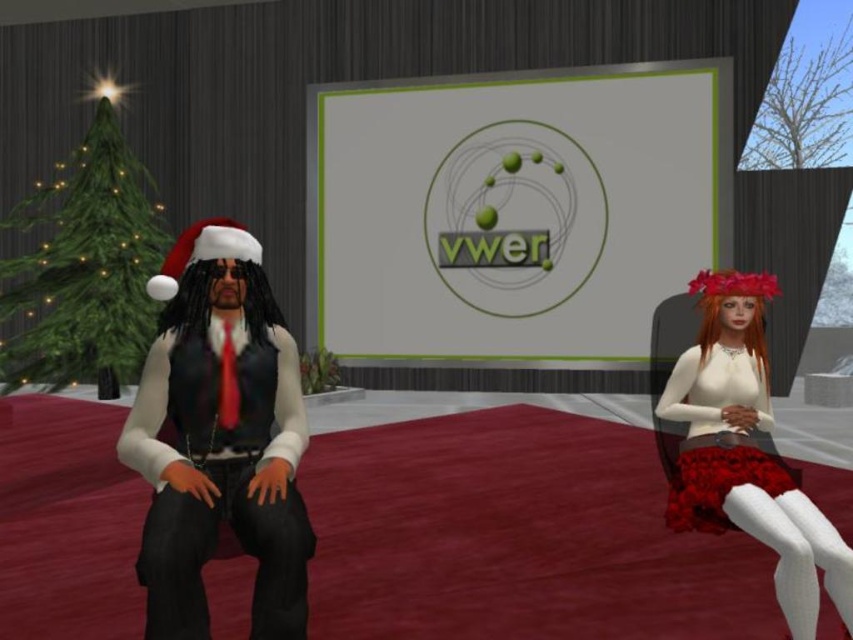
Looking at this image, does matte black vest at center appear on the right side of velvet red skirt at right?

No, matte black vest at center is not to the right of velvet red skirt at right.

Can you confirm if matte black vest at center is wider than velvet red skirt at right?

No, matte black vest at center is not wider than velvet red skirt at right.

Who is more distant from viewer, (235, 268) or (694, 454)?

Positioned behind is point (694, 454).

The height and width of the screenshot is (640, 853). What are the coordinates of `matte black vest at center` in the screenshot? It's located at (219, 436).

Between green matte christmas tree at left and black denim jeans at center, which one is positioned higher?

green matte christmas tree at left is higher up.

Is point (68, 240) farther from viewer compared to point (244, 492)?

Yes, it is.

Is point (62, 177) behind point (161, 628)?

Yes, point (62, 177) is behind point (161, 628).

You are a GUI agent. You are given a task and a screenshot of the screen. Output one action in this format:
    pyautogui.click(x=<x>, y=<y>)
    Task: Click on the green matte christmas tree at left
    Image resolution: width=853 pixels, height=640 pixels.
    Given the screenshot: What is the action you would take?
    pyautogui.click(x=83, y=268)

Who is taller, green matte christmas tree at left or velvet red skirt at right?

Standing taller between the two is velvet red skirt at right.

Find the location of `green matte christmas tree at left`. green matte christmas tree at left is located at coordinates (83, 268).